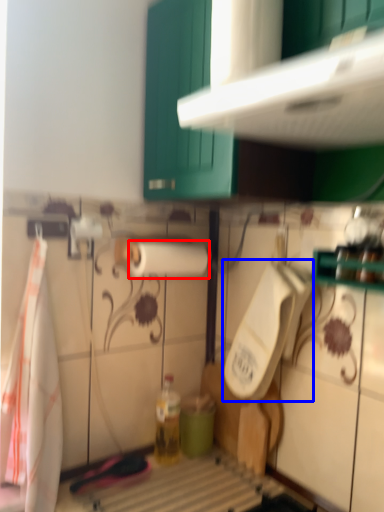
Question: Which object appears farthest to the camera in this image, paper towel (highlighted by a red box) or urinal (highlighted by a blue box)?

Choices:
 (A) paper towel
 (B) urinal

Answer: (A)